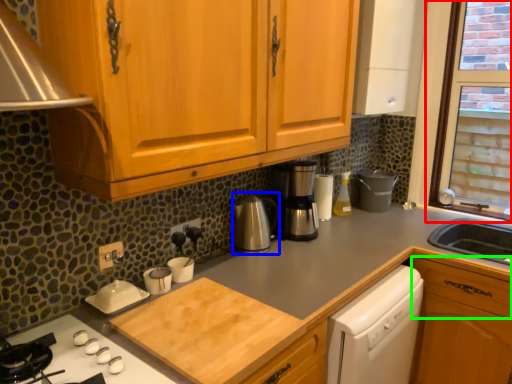
Question: Considering the real-world distances, which object is closest to window (highlighted by a red box)? coffeepot (highlighted by a blue box) or drawer (highlighted by a green box).

Choices:
 (A) coffeepot
 (B) drawer

Answer: (B)